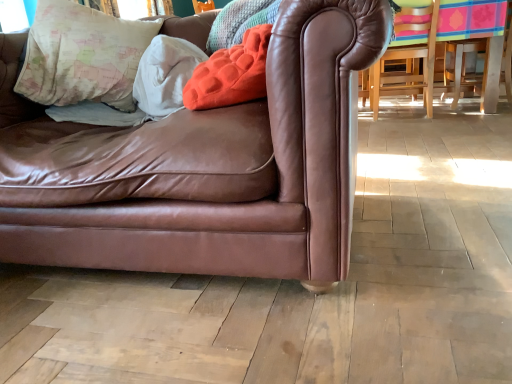
Question: Is white soft pillow at upper left, which is the 2th pillow from left to right, positioned in front of velvety orange pillow at upper center, marked as the first pillow in a right-to-left arrangement?

Choices:
 (A) yes
 (B) no

Answer: (B)

Question: Is velvety orange pillow at upper center, marked as the first pillow in a right-to-left arrangement, surrounded by white soft pillow at upper left, which is the 2th pillow from left to right?

Choices:
 (A) yes
 (B) no

Answer: (B)

Question: Considering the relative sizes of white soft pillow at upper left, the second pillow positioned from the right, and velvety orange pillow at upper center, which appears as the 3th pillow when viewed from the left, in the image provided, is white soft pillow at upper left, the second pillow positioned from the right, shorter than velvety orange pillow at upper center, which appears as the 3th pillow when viewed from the left,?

Choices:
 (A) no
 (B) yes

Answer: (A)

Question: Does white soft pillow at upper left, the second pillow positioned from the right, appear on the right side of velvety orange pillow at upper center, marked as the first pillow in a right-to-left arrangement?

Choices:
 (A) yes
 (B) no

Answer: (B)

Question: Can you confirm if white soft pillow at upper left, the second pillow positioned from the right, is wider than velvety orange pillow at upper center, marked as the first pillow in a right-to-left arrangement?

Choices:
 (A) no
 (B) yes

Answer: (A)

Question: From the image's perspective, is white soft pillow at upper left, the second pillow positioned from the right, positioned above or below brown leather couch at center?

Choices:
 (A) above
 (B) below

Answer: (A)

Question: Is white soft pillow at upper left, the second pillow positioned from the right, bigger or smaller than brown leather couch at center?

Choices:
 (A) small
 (B) big

Answer: (A)

Question: Is white soft pillow at upper left, the second pillow positioned from the right, to the left or to the right of brown leather couch at center in the image?

Choices:
 (A) right
 (B) left

Answer: (A)

Question: Is point (138, 102) closer or farther from the camera than point (100, 167)?

Choices:
 (A) farther
 (B) closer

Answer: (A)

Question: From a real-world perspective, is velvety orange pillow at upper center, which appears as the 3th pillow when viewed from the left, positioned above or below map-patterned fabric pillow at upper left, the third pillow positioned from the right?

Choices:
 (A) below
 (B) above

Answer: (A)

Question: In terms of height, does velvety orange pillow at upper center, marked as the first pillow in a right-to-left arrangement, look taller or shorter compared to map-patterned fabric pillow at upper left, the third pillow positioned from the right?

Choices:
 (A) short
 (B) tall

Answer: (A)

Question: From the image's perspective, relative to map-patterned fabric pillow at upper left, which ranks as the first pillow in left-to-right order, is velvety orange pillow at upper center, marked as the first pillow in a right-to-left arrangement, above or below?

Choices:
 (A) above
 (B) below

Answer: (B)

Question: Is velvety orange pillow at upper center, which appears as the 3th pillow when viewed from the left, in front of or behind map-patterned fabric pillow at upper left, which ranks as the first pillow in left-to-right order, in the image?

Choices:
 (A) behind
 (B) front

Answer: (B)

Question: From the image's perspective, is velvety orange pillow at upper center, marked as the first pillow in a right-to-left arrangement, located above or below brown leather couch at center?

Choices:
 (A) above
 (B) below

Answer: (A)

Question: Considering the positions of velvety orange pillow at upper center, marked as the first pillow in a right-to-left arrangement, and brown leather couch at center in the image, is velvety orange pillow at upper center, marked as the first pillow in a right-to-left arrangement, wider or thinner than brown leather couch at center?

Choices:
 (A) wide
 (B) thin

Answer: (B)